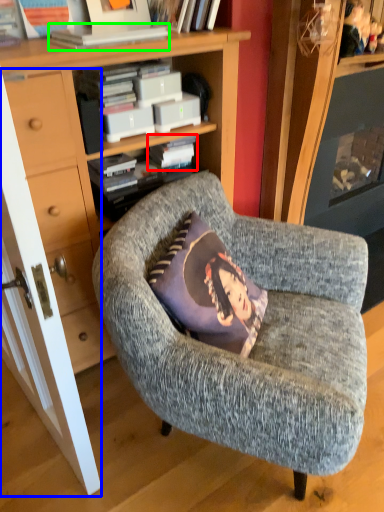
Question: Based on their relative distances, which object is farther from paperback book (highlighted by a red box)? Choose from door (highlighted by a blue box) and book (highlighted by a green box).

Choices:
 (A) door
 (B) book

Answer: (A)